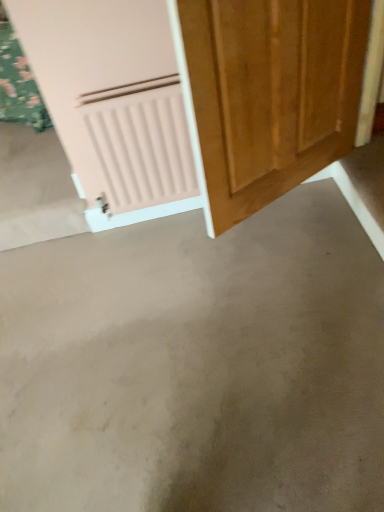
Question: Considering the positions of wooden door at center and gray concrete at center in the image, is wooden door at center wider or thinner than gray concrete at center?

Choices:
 (A) thin
 (B) wide

Answer: (A)

Question: From the image's perspective, is wooden door at center above or below gray concrete at center?

Choices:
 (A) above
 (B) below

Answer: (A)

Question: Looking at the image, does wooden door at center seem bigger or smaller compared to gray concrete at center?

Choices:
 (A) small
 (B) big

Answer: (A)

Question: From a real-world perspective, relative to wooden door at center, is gray concrete at center vertically above or below?

Choices:
 (A) above
 (B) below

Answer: (B)

Question: Visually, is gray concrete at center positioned to the left or to the right of wooden door at center?

Choices:
 (A) right
 (B) left

Answer: (B)

Question: Is gray concrete at center wider or thinner than wooden door at center?

Choices:
 (A) wide
 (B) thin

Answer: (A)

Question: Is point (309, 345) positioned closer to the camera than point (322, 33)?

Choices:
 (A) farther
 (B) closer

Answer: (A)